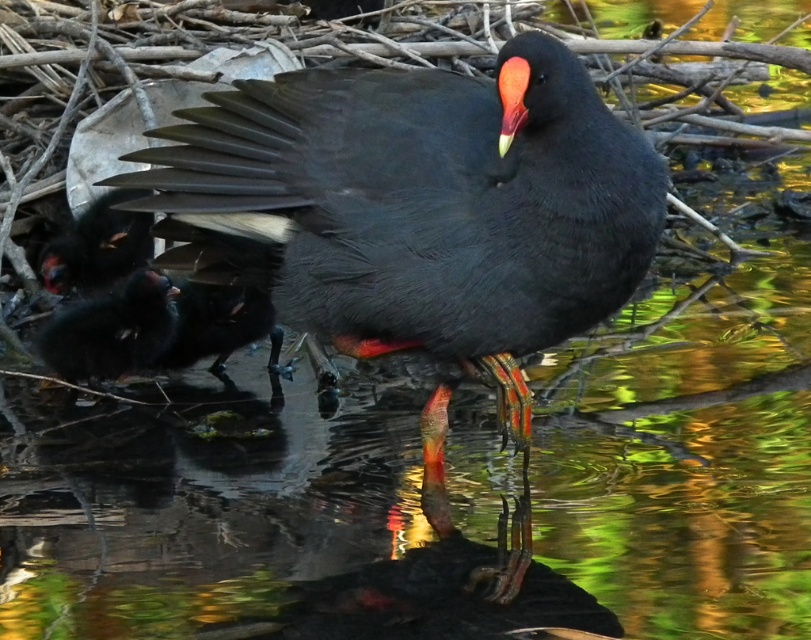
Question: Is matte black bird at center to the left of matte black bird at lower left from the viewer's perspective?

Choices:
 (A) yes
 (B) no

Answer: (B)

Question: Which point is farther from the camera taking this photo?

Choices:
 (A) (91, 381)
 (B) (543, 193)

Answer: (A)

Question: Is matte black bird at center behind matte black bird at lower left?

Choices:
 (A) no
 (B) yes

Answer: (A)

Question: Is matte black bird at center above matte black bird at lower left?

Choices:
 (A) yes
 (B) no

Answer: (A)